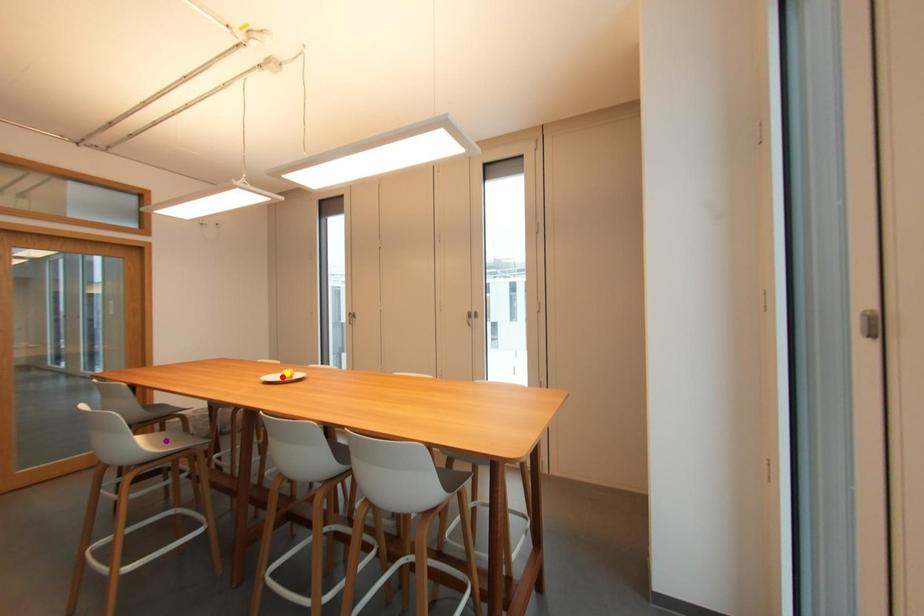
Order these from nearest to farthest:
yellow point
purple point
red point

1. yellow point
2. red point
3. purple point